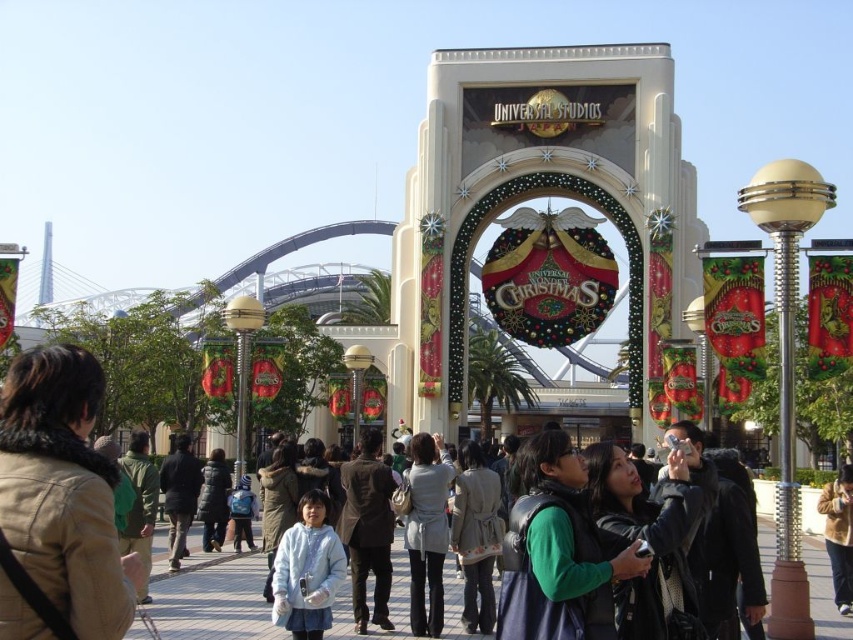
Question: Can you confirm if tan leather jacket at left is smaller than light blue denim jacket at center?

Choices:
 (A) yes
 (B) no

Answer: (B)

Question: Can you confirm if tan leather jacket at left is positioned to the left of light blue denim jacket at center?

Choices:
 (A) no
 (B) yes

Answer: (B)

Question: Which point is farther to the camera?

Choices:
 (A) (206, 547)
 (B) (84, 365)
 (C) (281, 484)
 (D) (483, 604)

Answer: (A)

Question: Considering the real-world distances, which object is farthest from the black leather jacket at center?

Choices:
 (A) tan leather jacket at left
 (B) dark brown leather jacket at lower left
 (C) light gray fabric coat at center

Answer: (B)

Question: Does brown suede jacket at lower right have a smaller size compared to dark gray puffer jacket at center?

Choices:
 (A) yes
 (B) no

Answer: (B)

Question: Which point is closer to the camera?

Choices:
 (A) (364, 531)
 (B) (169, 534)
 (C) (462, 515)

Answer: (C)